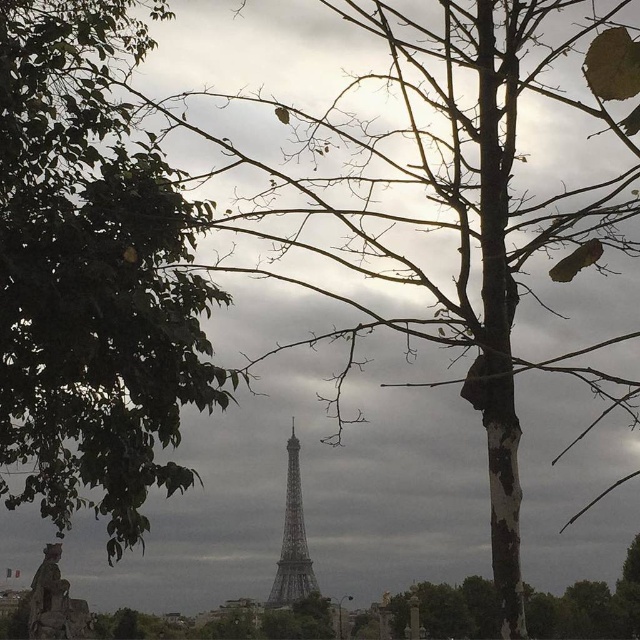
In the scene shown: Is green leafy tree at left in front of metallic gray eiffel tower at center?

Yes.

Who is shorter, green leafy tree at left or metallic gray eiffel tower at center?

metallic gray eiffel tower at center

This screenshot has height=640, width=640. Describe the element at coordinates (92, 275) in the screenshot. I see `green leafy tree at left` at that location.

You are a GUI agent. You are given a task and a screenshot of the screen. Output one action in this format:
    pyautogui.click(x=<x>, y=<y>)
    Task: Click on the green leafy tree at left
    This screenshot has width=640, height=640.
    Given the screenshot: What is the action you would take?
    pyautogui.click(x=92, y=275)